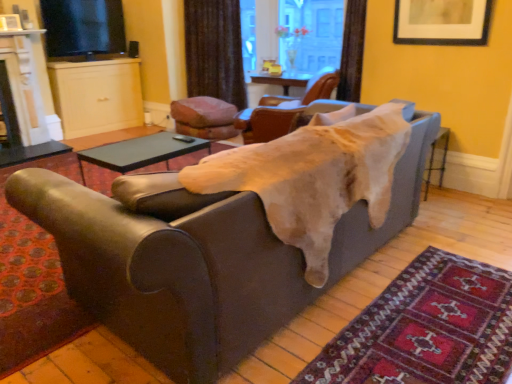
Question: From the image's perspective, is transparent glass door at upper center on top of leather couch at center?

Choices:
 (A) no
 (B) yes

Answer: (B)

Question: From a real-world perspective, does transparent glass door at upper center sit lower than leather couch at center?

Choices:
 (A) yes
 (B) no

Answer: (B)

Question: Could you tell me if transparent glass door at upper center is facing leather couch at center?

Choices:
 (A) yes
 (B) no

Answer: (A)

Question: Does transparent glass door at upper center have a greater height compared to leather couch at center?

Choices:
 (A) no
 (B) yes

Answer: (B)

Question: Is transparent glass door at upper center surrounding leather couch at center?

Choices:
 (A) yes
 (B) no

Answer: (B)

Question: Does transparent glass door at upper center have a larger size compared to leather couch at center?

Choices:
 (A) yes
 (B) no

Answer: (B)

Question: From a real-world perspective, is leather couch at center positioned over brown fabric curtain at upper center based on gravity?

Choices:
 (A) no
 (B) yes

Answer: (A)

Question: Is leather couch at center next to brown fabric curtain at upper center?

Choices:
 (A) yes
 (B) no

Answer: (B)

Question: Considering the relative sizes of leather couch at center and brown fabric curtain at upper center in the image provided, is leather couch at center bigger than brown fabric curtain at upper center?

Choices:
 (A) yes
 (B) no

Answer: (A)

Question: Is leather couch at center not close to brown fabric curtain at upper center?

Choices:
 (A) yes
 (B) no

Answer: (A)

Question: Considering the relative sizes of leather couch at center and brown fabric curtain at upper center in the image provided, is leather couch at center shorter than brown fabric curtain at upper center?

Choices:
 (A) yes
 (B) no

Answer: (A)

Question: Does leather couch at center lie behind brown fabric curtain at upper center?

Choices:
 (A) yes
 (B) no

Answer: (B)

Question: From the image's perspective, is brown leather chair at upper center, the 3th chair from the left, above matte black picture frame at upper right?

Choices:
 (A) no
 (B) yes

Answer: (A)